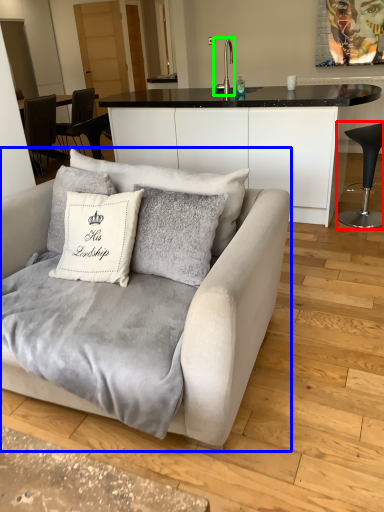
Question: Which is farther away from chair (highlighted by a red box)? studio couch (highlighted by a blue box) or silver (highlighted by a green box)?

Choices:
 (A) studio couch
 (B) silver

Answer: (B)